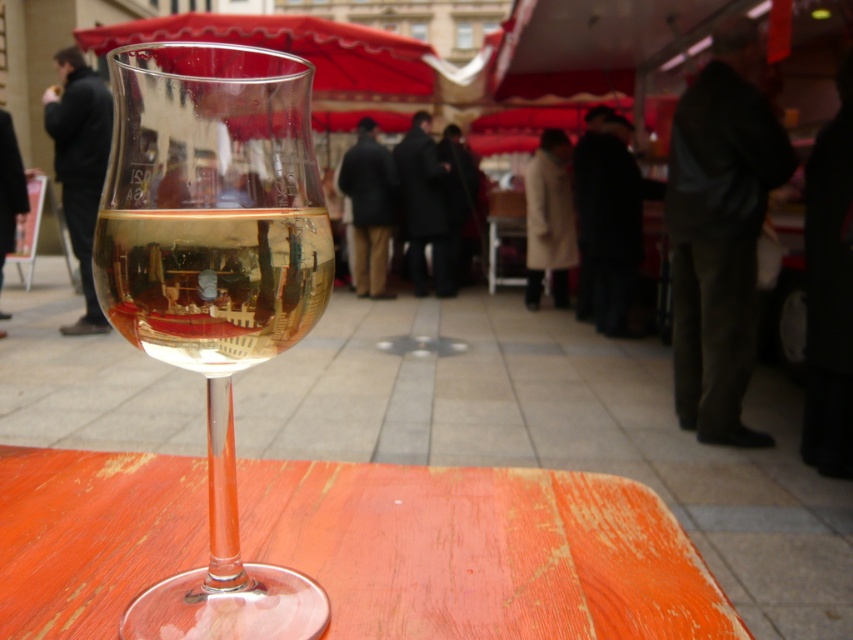
Which is more to the left, wooden table at center or clear glass wine glass at center?

Positioned to the left is wooden table at center.

Is wooden table at center thinner than clear glass wine glass at center?

Incorrect, wooden table at center's width is not less than clear glass wine glass at center's.

Is point (357, 600) positioned in front of point (276, 67)?

No, it is not.

Locate an element on the screen. The width and height of the screenshot is (853, 640). wooden table at center is located at coordinates (480, 552).

Measure the distance between wooden table at center and red fabric canopy at upper center.

wooden table at center is 8.30 inches away from red fabric canopy at upper center.

Which is below, wooden table at center or red fabric canopy at upper center?

Positioned lower is wooden table at center.

Which is in front, point (320, 557) or point (370, 77)?

Point (320, 557) is in front.

At what (x,y) coordinates should I click in order to perform the action: click on wooden table at center. Please return your answer as a coordinate pair (x, y). This screenshot has width=853, height=640. Looking at the image, I should click on (480, 552).

Does clear glass wine glass at center have a greater width compared to clear glass wine at center?

Incorrect, clear glass wine glass at center's width does not surpass clear glass wine at center's.

Measure the distance between point (239, 632) and camera.

Point (239, 632) is 8.72 inches away from camera.

Find the location of `clear glass wine glass at center`. clear glass wine glass at center is located at coordinates pyautogui.click(x=213, y=284).